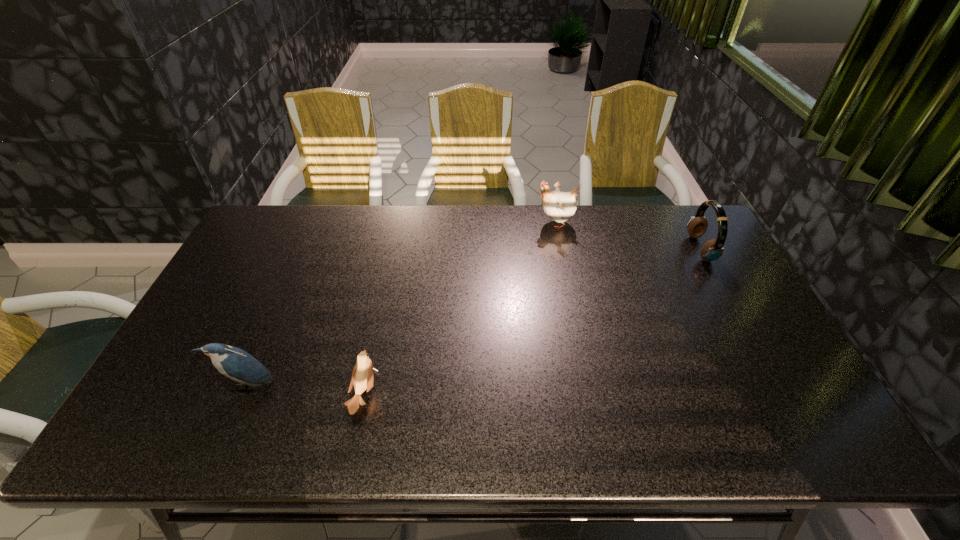
You are a GUI agent. You are given a task and a screenshot of the screen. Output one action in this format:
    pyautogui.click(x=<x>, y=<y>)
    Task: Click on the empty space between the rightmost bird and the leftmost bird
    This screenshot has height=540, width=960.
    Given the screenshot: What is the action you would take?
    pyautogui.click(x=400, y=305)

Identify the location of vacant point located between the shortest bird and the leftmost bird. (305, 390).

In order to click on vacant point located between the leftmost object and the headset in this screenshot , I will do `click(473, 318)`.

Find the location of `free space that is in between the second object from right to left and the third object from right to left`. free space that is in between the second object from right to left and the third object from right to left is located at coordinates (460, 309).

I want to click on free space between the shortest object and the rightmost bird, so click(x=460, y=309).

The height and width of the screenshot is (540, 960). What are the coordinates of `object that stands as the closest to the rightmost bird` in the screenshot? It's located at (712, 250).

Select which object appears as the second closest to the rightmost object. Please provide its 2D coordinates. Your answer should be formatted as a tuple, i.e. [(x, y)], where the tuple contains the x and y coordinates of a point satisfying the conditions above.

[(362, 377)]

At what (x,y) coordinates should I click in order to perform the action: click on the closest bird relative to the leftmost bird. Please return your answer as a coordinate pair (x, y). This screenshot has width=960, height=540. Looking at the image, I should click on (362, 377).

Image resolution: width=960 pixels, height=540 pixels. I want to click on bird that is the second closest to the leftmost bird, so click(x=559, y=206).

Where is `vacant area in the image that satisfies the following two spatial constraints: 1. at the beak of the rightmost bird; 2. at the tip of the leftmost bird's beak`? vacant area in the image that satisfies the following two spatial constraints: 1. at the beak of the rightmost bird; 2. at the tip of the leftmost bird's beak is located at coordinates (588, 386).